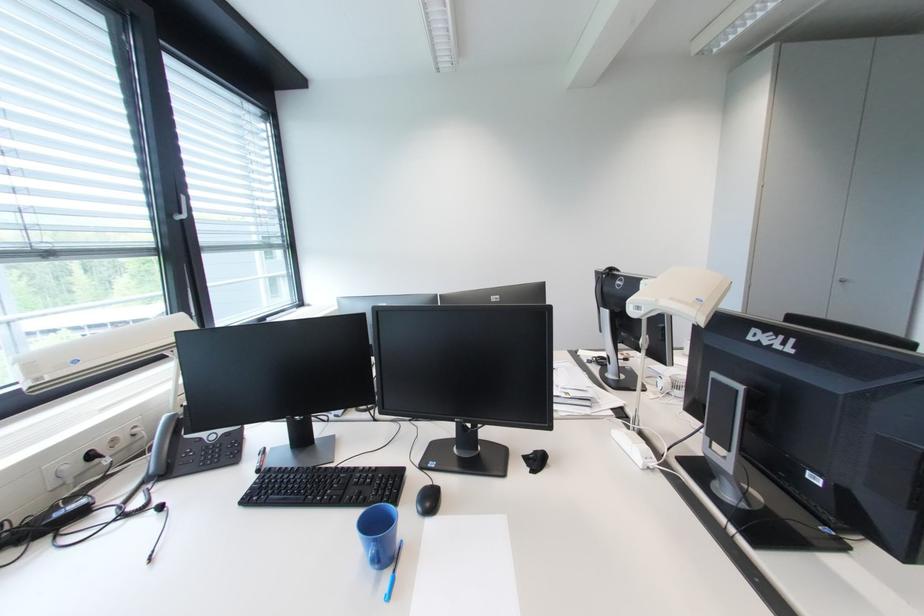
Image resolution: width=924 pixels, height=616 pixels. What do you see at coordinates (161, 447) in the screenshot? I see `the telephone handset` at bounding box center [161, 447].